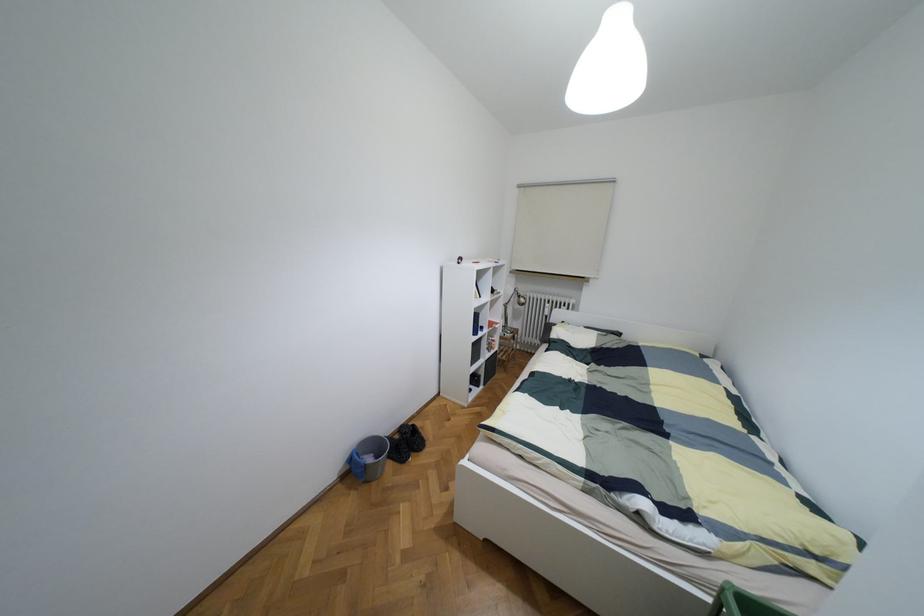
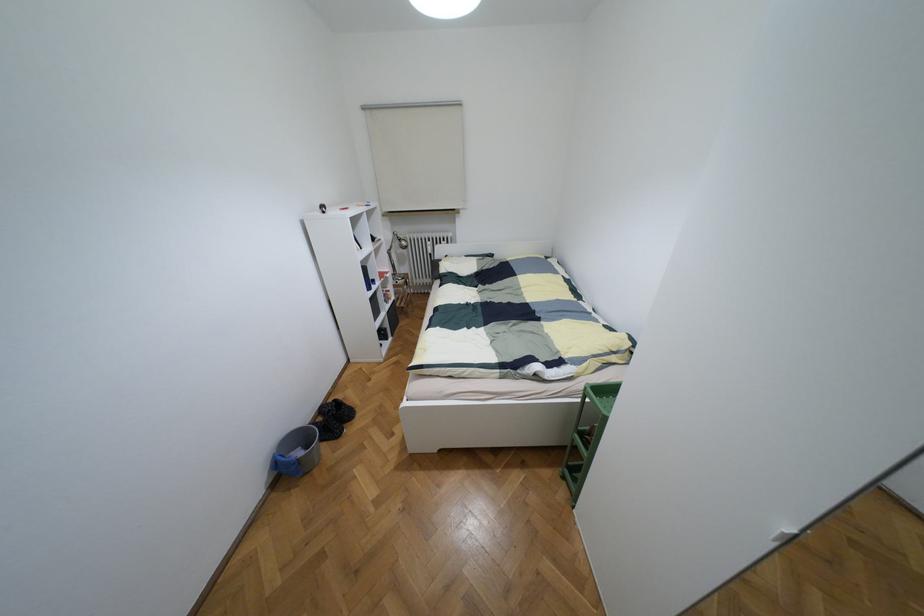
First-person continuous shooting, in which direction is the camera rotating?

The rotation direction of the camera is right-down.